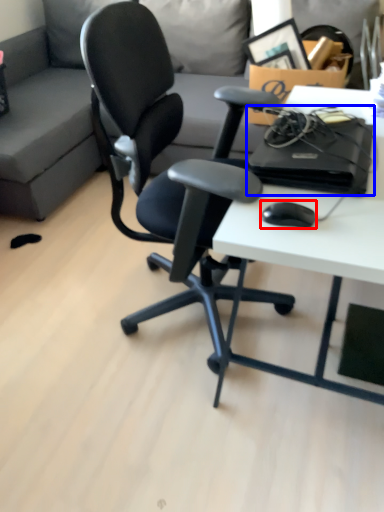
Question: Among these objects, which one is farthest to the camera, mouse (highlighted by a red box) or computer (highlighted by a blue box)?

Choices:
 (A) mouse
 (B) computer

Answer: (B)